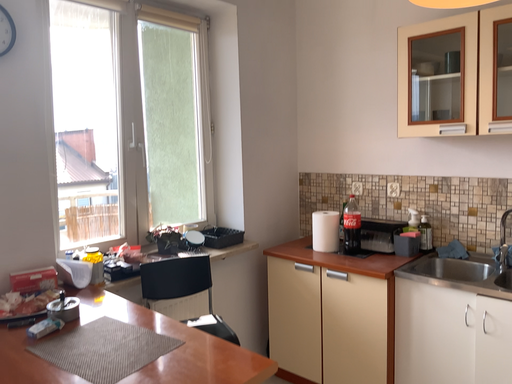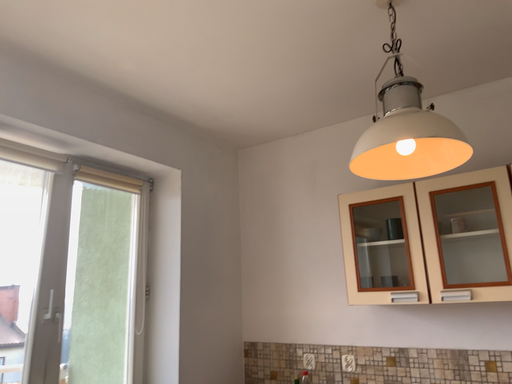
Question: Which way did the camera rotate in the video?

Choices:
 (A) rotated downward
 (B) rotated upward

Answer: (B)